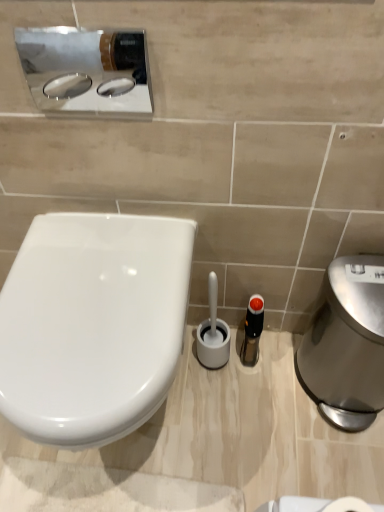
Question: From a real-world perspective, is polished stainless steel hand dryer at right over white glossy toilet at left?

Choices:
 (A) no
 (B) yes

Answer: (A)

Question: Is polished stainless steel hand dryer at right to the left of white glossy toilet at left from the viewer's perspective?

Choices:
 (A) no
 (B) yes

Answer: (A)

Question: Can you confirm if polished stainless steel hand dryer at right is thinner than white glossy toilet at left?

Choices:
 (A) yes
 (B) no

Answer: (A)

Question: Considering the relative sizes of polished stainless steel hand dryer at right and white glossy toilet at left in the image provided, is polished stainless steel hand dryer at right shorter than white glossy toilet at left?

Choices:
 (A) no
 (B) yes

Answer: (A)

Question: From a real-world perspective, does polished stainless steel hand dryer at right sit lower than white glossy toilet at left?

Choices:
 (A) yes
 (B) no

Answer: (A)

Question: Is polished stainless steel hand dryer at right outside of white glossy toilet at left?

Choices:
 (A) no
 (B) yes

Answer: (B)

Question: Is translucent plastic bottle at center shorter than polished stainless steel hand dryer at right?

Choices:
 (A) no
 (B) yes

Answer: (B)

Question: Is polished stainless steel hand dryer at right surrounded by translucent plastic bottle at center?

Choices:
 (A) yes
 (B) no

Answer: (B)

Question: Does translucent plastic bottle at center have a smaller size compared to polished stainless steel hand dryer at right?

Choices:
 (A) no
 (B) yes

Answer: (B)

Question: From the image's perspective, is translucent plastic bottle at center located beneath polished stainless steel hand dryer at right?

Choices:
 (A) no
 (B) yes

Answer: (A)

Question: Considering the relative sizes of translucent plastic bottle at center and polished stainless steel hand dryer at right in the image provided, is translucent plastic bottle at center thinner than polished stainless steel hand dryer at right?

Choices:
 (A) yes
 (B) no

Answer: (A)

Question: Can you confirm if translucent plastic bottle at center is positioned to the left of polished stainless steel hand dryer at right?

Choices:
 (A) yes
 (B) no

Answer: (A)

Question: Considering the relative positions of polished stainless steel hand dryer at right and polished chrome sink at upper left in the image provided, is polished stainless steel hand dryer at right to the left of polished chrome sink at upper left from the viewer's perspective?

Choices:
 (A) no
 (B) yes

Answer: (A)